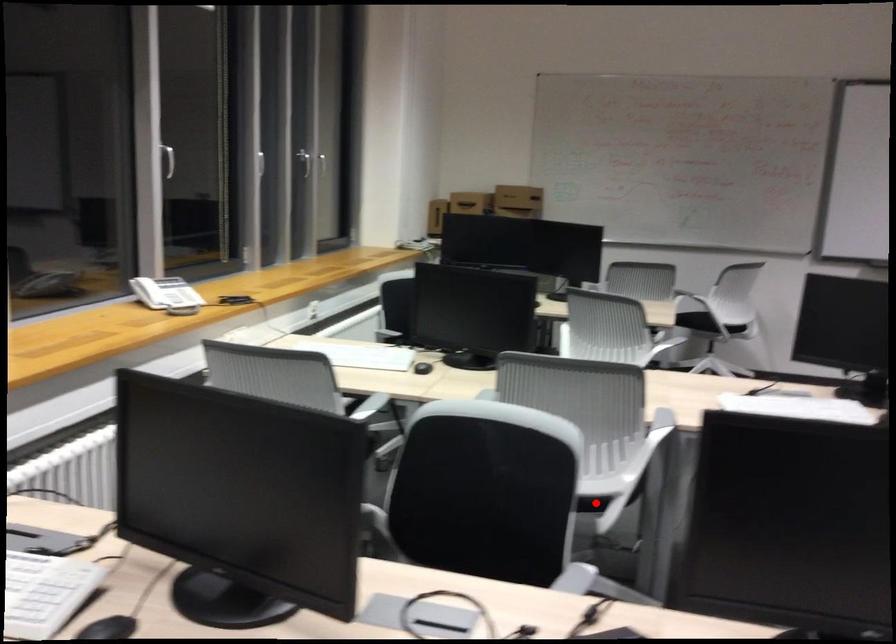
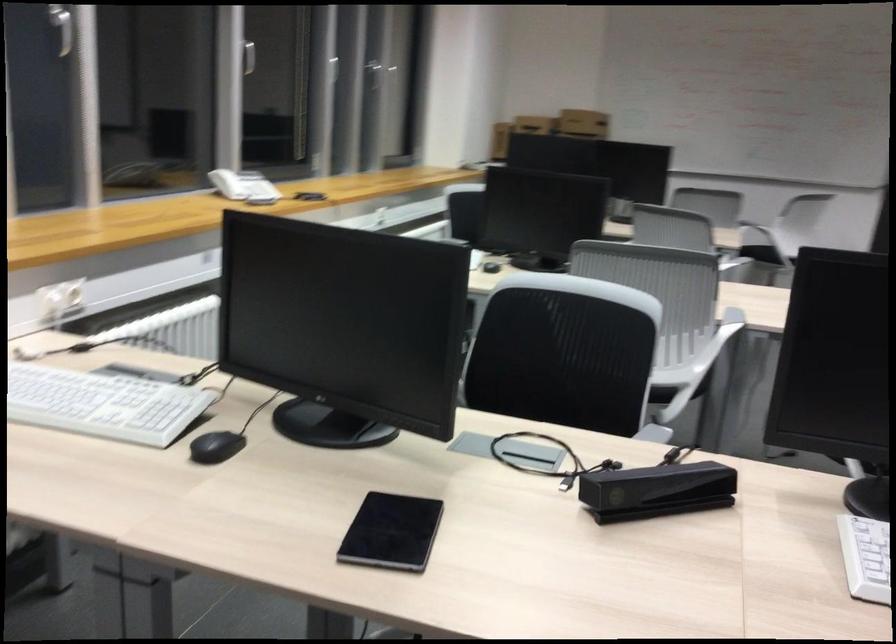
The point at the highlighted location is marked in the first image. Where is the corresponding point in the second image?

(661, 395)